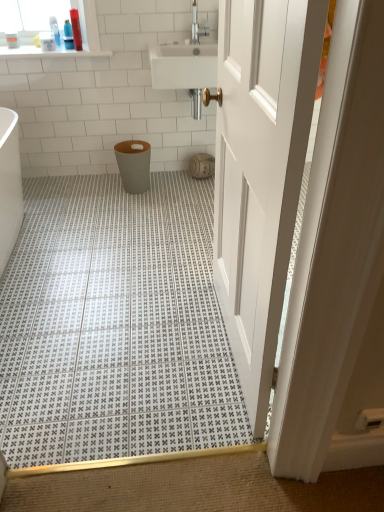
You are a GUI agent. You are given a task and a screenshot of the screen. Output one action in this format:
    pyautogui.click(x=<x>, y=<y>)
    Task: Click on the white plastic bottle at upper left, which is the 1th toiletry from left to right
    
    Given the screenshot: What is the action you would take?
    pyautogui.click(x=47, y=41)

What do you see at coordinates (76, 29) in the screenshot? The height and width of the screenshot is (512, 384). I see `translucent plastic tube at upper left, the third toiletry positioned from the left` at bounding box center [76, 29].

The image size is (384, 512). Describe the element at coordinates (68, 35) in the screenshot. I see `matte plastic bottle at upper left, the second toiletry when ordered from left to right` at that location.

What is the approximate width of white glossy countertop at upper left?

18.62 inches.

Locate an element on the screen. Image resolution: width=384 pixels, height=512 pixels. brushed metal faucet at upper center is located at coordinates (196, 26).

From a real-world perspective, which object stands above the other?

brushed metal faucet at upper center is physically above.

Is matte beige toilet paper at center oriented towards brushed metal faucet at upper center?

No, matte beige toilet paper at center does not turn towards brushed metal faucet at upper center.

Between matte beige toilet paper at center and brushed metal faucet at upper center, which one has smaller size?

→ brushed metal faucet at upper center.

Considering the sizes of objects matte beige toilet paper at center and brushed metal faucet at upper center in the image provided, who is taller, matte beige toilet paper at center or brushed metal faucet at upper center?

brushed metal faucet at upper center.

Does matte gray plastic toilet bowl at center have a larger size compared to white plastic bottle at upper left, which is the 1th toiletry from left to right?

Indeed, matte gray plastic toilet bowl at center has a larger size compared to white plastic bottle at upper left, which is the 1th toiletry from left to right.

Identify the location of toilet bowl below the white plastic bottle at upper left, acting as the 3th toiletry starting from the right (from a real-world perspective). (134, 165).

In the image, is matte gray plastic toilet bowl at center on the left side or the right side of white plastic bottle at upper left, acting as the 3th toiletry starting from the right?

Clearly, matte gray plastic toilet bowl at center is on the right of white plastic bottle at upper left, acting as the 3th toiletry starting from the right, in the image.

Which object is more forward, matte gray plastic toilet bowl at center or white plastic bottle at upper left, acting as the 3th toiletry starting from the right?

white plastic bottle at upper left, acting as the 3th toiletry starting from the right.

How different are the orientations of white plastic bottle at upper left, acting as the 3th toiletry starting from the right, and matte gray plastic toilet bowl at center in degrees?

white plastic bottle at upper left, acting as the 3th toiletry starting from the right, and matte gray plastic toilet bowl at center are facing 0.000215 degrees away from each other.

Does point (48, 44) appear closer or farther from the camera than point (144, 148)?

Point (48, 44) is farther from the camera than point (144, 148).

Does white plastic bottle at upper left, which is the 1th toiletry from left to right, turn towards matte gray plastic toilet bowl at center?

No, white plastic bottle at upper left, which is the 1th toiletry from left to right, is not aimed at matte gray plastic toilet bowl at center.

From a real-world perspective, is white plastic bottle at upper left, acting as the 3th toiletry starting from the right, positioned over matte gray plastic toilet bowl at center based on gravity?

Yes, from a real-world perspective, white plastic bottle at upper left, acting as the 3th toiletry starting from the right, is on top of matte gray plastic toilet bowl at center.

Between brushed metal faucet at upper center and matte beige toilet paper at center, which one has smaller size?

With smaller size is brushed metal faucet at upper center.

What's the angular difference between brushed metal faucet at upper center and matte beige toilet paper at center's facing directions?

The angular difference between brushed metal faucet at upper center and matte beige toilet paper at center is 0.184 degrees.

Is point (202, 31) positioned in front of point (194, 162)?

That is True.

How many degrees apart are the facing directions of brushed metal faucet at upper center and white glossy countertop at upper left?

The facing directions of brushed metal faucet at upper center and white glossy countertop at upper left are 0.476 degrees apart.

Is white glossy countertop at upper left surrounded by brushed metal faucet at upper center?

Actually, white glossy countertop at upper left is outside brushed metal faucet at upper center.

From a real-world perspective, is brushed metal faucet at upper center physically located above or below white glossy countertop at upper left?

Clearly, from a real-world perspective, brushed metal faucet at upper center is above white glossy countertop at upper left.

Consider the image. Does brushed metal faucet at upper center lie behind white glossy countertop at upper left?

No, brushed metal faucet at upper center is closer to the viewer.

The height and width of the screenshot is (512, 384). What are the coordinates of `toilet paper on the right of the matte plastic bottle at upper left, which ranks as the 2th toiletry in right-to-left order` in the screenshot? It's located at (202, 166).

Which is behind, point (71, 47) or point (193, 160)?

The point (193, 160) is more distant.

Consider the image. Is matte plastic bottle at upper left, the second toiletry when ordered from left to right, not inside matte beige toilet paper at center?

matte plastic bottle at upper left, the second toiletry when ordered from left to right, is positioned outside matte beige toilet paper at center.

From the picture: Does matte plastic bottle at upper left, which ranks as the 2th toiletry in right-to-left order, have a greater width compared to matte beige toilet paper at center?

In fact, matte plastic bottle at upper left, which ranks as the 2th toiletry in right-to-left order, might be narrower than matte beige toilet paper at center.

Is matte plastic bottle at upper left, the second toiletry when ordered from left to right, located within white glossy countertop at upper left?

No, matte plastic bottle at upper left, the second toiletry when ordered from left to right, is located outside of white glossy countertop at upper left.

You are a GUI agent. You are given a task and a screenshot of the screen. Output one action in this format:
    pyautogui.click(x=<x>, y=<y>)
    Task: Click on the counter top below the matte plastic bottle at upper left, which ranks as the 2th toiletry in right-to-left order (from a real-world perspective)
    
    Given the screenshot: What is the action you would take?
    pyautogui.click(x=50, y=52)

Does white glossy countertop at upper left turn towards matte plastic bottle at upper left, which ranks as the 2th toiletry in right-to-left order?

No, white glossy countertop at upper left is not facing towards matte plastic bottle at upper left, which ranks as the 2th toiletry in right-to-left order.

Where is `toilet paper on the right of brushed metal faucet at upper center`? toilet paper on the right of brushed metal faucet at upper center is located at coordinates (202, 166).

From a real-world perspective, which toiletry is the 1st one above the matte gray plastic toilet bowl at center? Please provide its 2D coordinates.

[(47, 41)]

Looking at the image, which one is located further to matte gray plastic toilet bowl at center, translucent plastic tube at upper left, arranged as the 1th toiletry when viewed from the right, or brushed metal faucet at upper center?

brushed metal faucet at upper center.

When comparing their distances from matte gray plastic toilet bowl at center, does white plastic bottle at upper left, acting as the 3th toiletry starting from the right, or white glossy countertop at upper left seem closer?

white glossy countertop at upper left.

Based on their spatial positions, is white plastic bottle at upper left, which is the 1th toiletry from left to right, or white glossy countertop at upper left closer to brushed metal faucet at upper center?

white glossy countertop at upper left is closer to brushed metal faucet at upper center.

Considering their positions, is white plastic bottle at upper left, acting as the 3th toiletry starting from the right, positioned closer to translucent plastic tube at upper left, the third toiletry positioned from the left, than matte beige toilet paper at center?

Among the two, white plastic bottle at upper left, acting as the 3th toiletry starting from the right, is located nearer to translucent plastic tube at upper left, the third toiletry positioned from the left.

In the scene shown: When comparing their distances from matte gray plastic toilet bowl at center, does brushed metal faucet at upper center or matte beige toilet paper at center seem further?

brushed metal faucet at upper center.

Considering their positions, is brushed metal faucet at upper center positioned closer to matte beige toilet paper at center than matte gray plastic toilet bowl at center?

Based on the image, matte gray plastic toilet bowl at center appears to be nearer to matte beige toilet paper at center.

Considering their positions, is matte beige toilet paper at center positioned closer to translucent plastic tube at upper left, the third toiletry positioned from the left, than matte gray plastic toilet bowl at center?

matte gray plastic toilet bowl at center is positioned closer to the anchor translucent plastic tube at upper left, the third toiletry positioned from the left.

Based on their spatial positions, is brushed metal faucet at upper center or translucent plastic tube at upper left, the third toiletry positioned from the left, further from white glossy countertop at upper left?

brushed metal faucet at upper center.

This screenshot has height=512, width=384. Identify the location of tap situated between white plastic bottle at upper left, acting as the 3th toiletry starting from the right, and matte beige toilet paper at center from left to right. (196, 26).

The image size is (384, 512). Find the location of `toilet bowl between white plastic bottle at upper left, acting as the 3th toiletry starting from the right, and brushed metal faucet at upper center from left to right`. toilet bowl between white plastic bottle at upper left, acting as the 3th toiletry starting from the right, and brushed metal faucet at upper center from left to right is located at coordinates (134, 165).

Find the location of a particular element. The height and width of the screenshot is (512, 384). tap between translucent plastic tube at upper left, the third toiletry positioned from the left, and matte beige toilet paper at center is located at coordinates (196, 26).

Locate an element on the screen. This screenshot has height=512, width=384. counter top between matte plastic bottle at upper left, which ranks as the 2th toiletry in right-to-left order, and matte gray plastic toilet bowl at center, in the vertical direction is located at coordinates (50, 52).